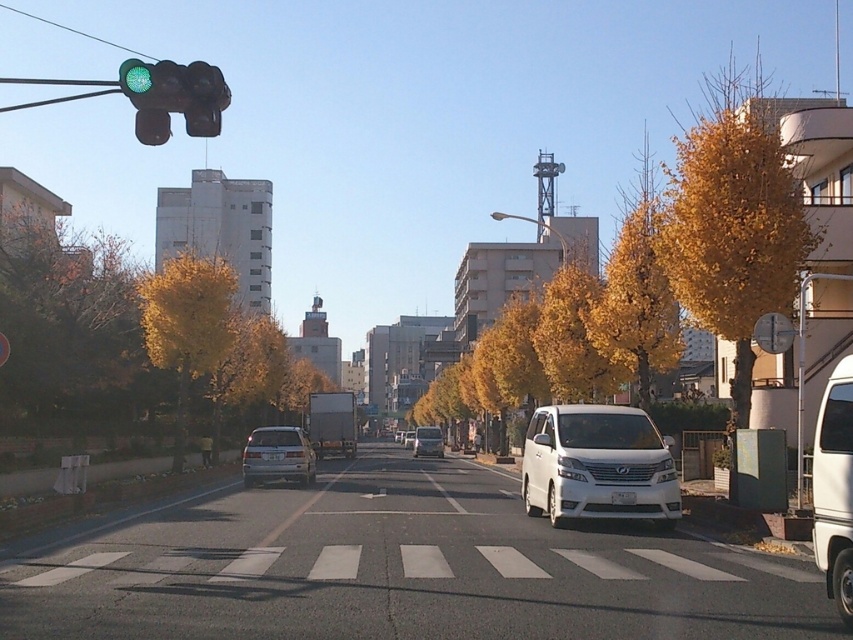
Can you confirm if yellow/golden leaves at center is taller than white asphalt line at center?

Correct, yellow/golden leaves at center is much taller as white asphalt line at center.

Is yellow/golden leaves at center thinner than white asphalt line at center?

In fact, yellow/golden leaves at center might be wider than white asphalt line at center.

Find the location of `yellow/golden leaves at center`. yellow/golden leaves at center is located at coordinates (573, 337).

Who is lower down, white matte van at right or matte black van at center?

Positioned lower is matte black van at center.

Does white matte van at right have a larger size compared to matte black van at center?

Yes, white matte van at right is bigger than matte black van at center.

You are a GUI agent. You are given a task and a screenshot of the screen. Output one action in this format:
    pyautogui.click(x=<x>, y=<y>)
    Task: Click on the white matte van at right
    The height and width of the screenshot is (640, 853).
    Given the screenshot: What is the action you would take?
    pyautogui.click(x=834, y=488)

Does sleek silver van at center appear on the right side of satin silver sedan at center?

Yes, sleek silver van at center is to the right of satin silver sedan at center.

Which is behind, point (653, 470) or point (260, 438)?

Point (260, 438)

Where is `sleek silver van at center`? sleek silver van at center is located at coordinates (x=598, y=465).